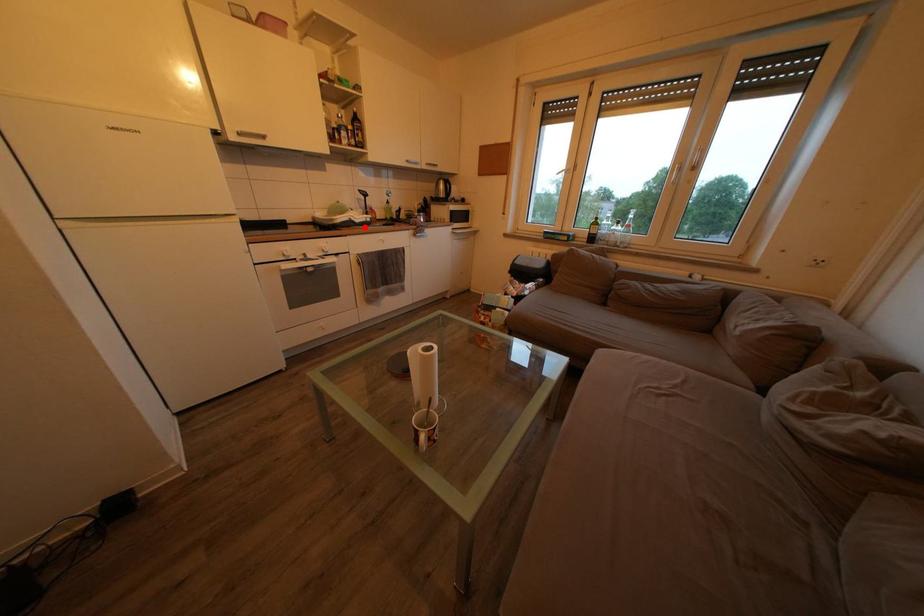
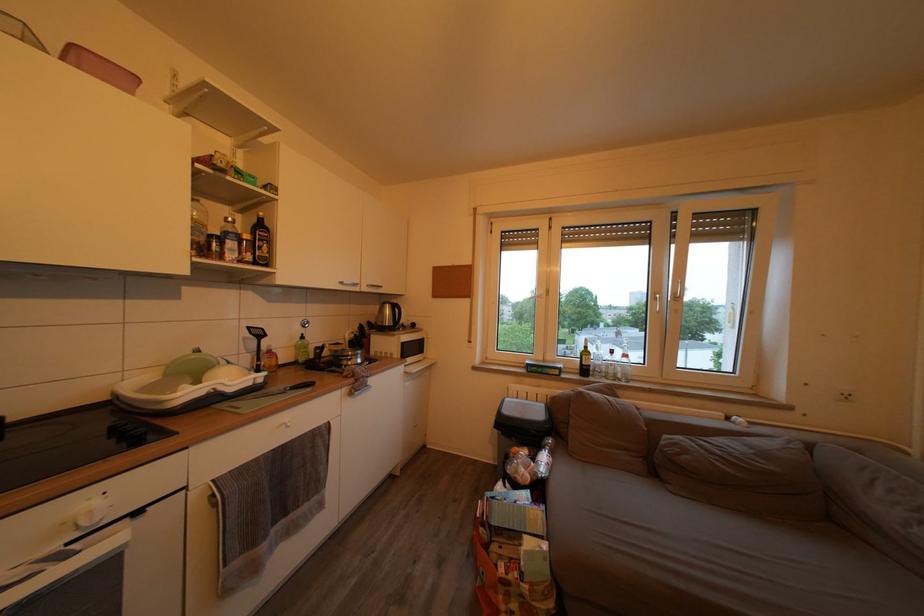
Find the pixel in the second image that matches the highlighted location in the first image.

(238, 397)